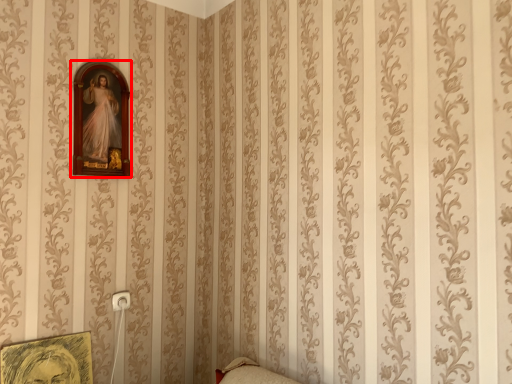
Question: From the image's perspective, what is the correct spatial relationship of picture frame (annotated by the red box) in relation to picture frame?

Choices:
 (A) below
 (B) above

Answer: (B)